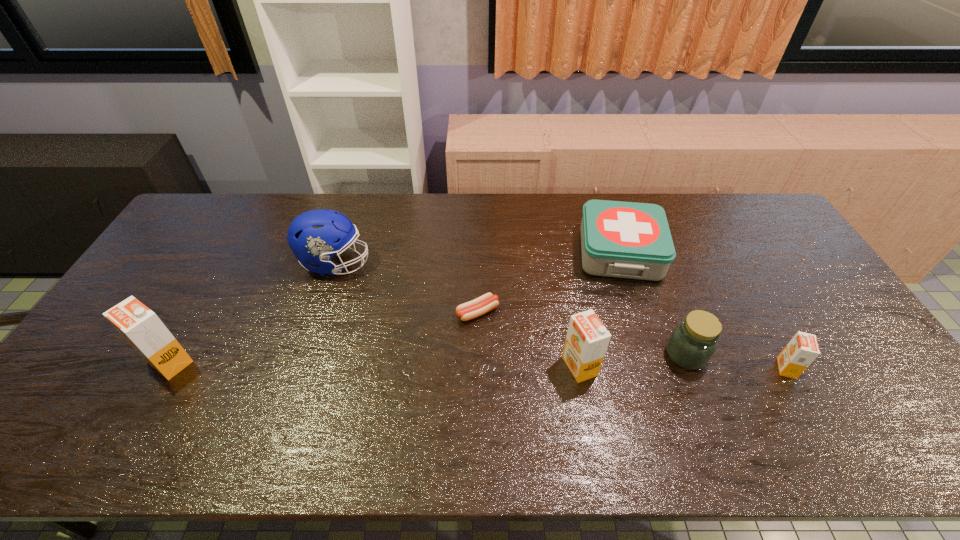
Where is `vacant space at the far edge`? The height and width of the screenshot is (540, 960). vacant space at the far edge is located at coordinates (280, 198).

Locate an element on the screen. free region at the near edge of the desktop is located at coordinates (641, 383).

The width and height of the screenshot is (960, 540). In the image, there is a desktop. Identify the location of vacant space at the left edge. (138, 362).

You are a GUI agent. You are given a task and a screenshot of the screen. Output one action in this format:
    pyautogui.click(x=<x>, y=<y>)
    Task: Click on the blank space at the right edge of the desktop
    
    Given the screenshot: What is the action you would take?
    pyautogui.click(x=798, y=321)

At what (x,y) coordinates should I click in order to perform the action: click on free space at the far left corner of the desktop. Please return your answer as a coordinate pair (x, y). This screenshot has height=540, width=960. Looking at the image, I should click on (212, 220).

The image size is (960, 540). Identify the location of free spot between the sausage and the leftmost orange juice. (324, 337).

Identify the location of free spot between the jar and the shortest orange juice. (736, 361).

The image size is (960, 540). I want to click on vacant space in between the jar and the rightmost orange juice, so click(736, 361).

At what (x,y) coordinates should I click in order to perform the action: click on blank region between the fifth nearest object and the leftmost object. Please return your answer as a coordinate pair (x, y). The height and width of the screenshot is (540, 960). Looking at the image, I should click on click(x=324, y=337).

The image size is (960, 540). Find the location of `free point between the jar and the second shortest orange juice`. free point between the jar and the second shortest orange juice is located at coordinates (633, 360).